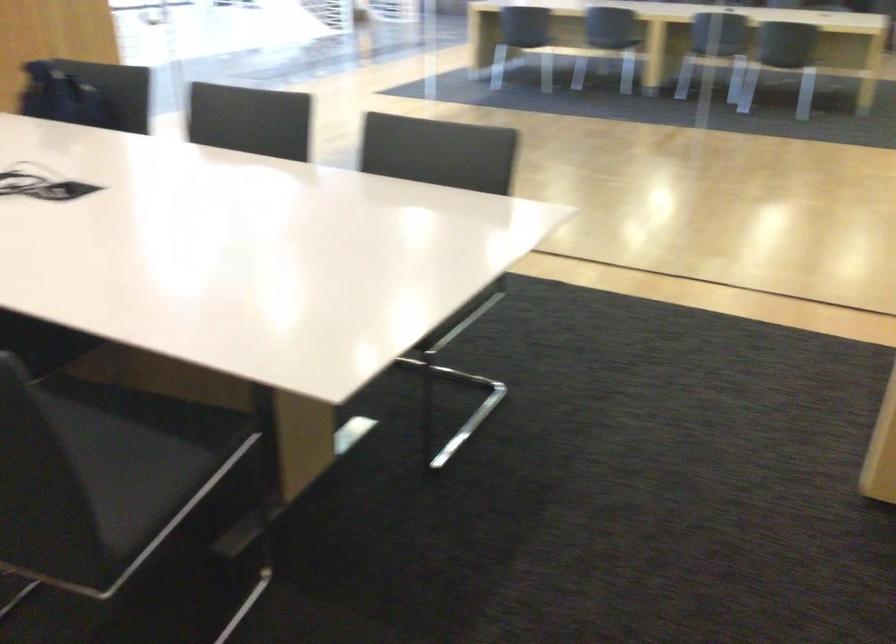
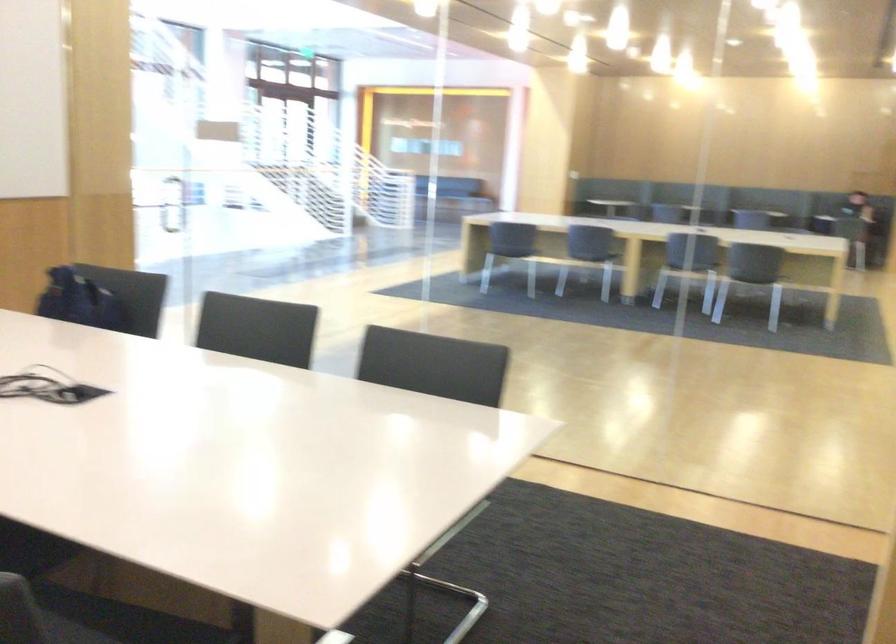
Where in the second image is the point corresponding to point 104,402 from the first image?

(88, 618)